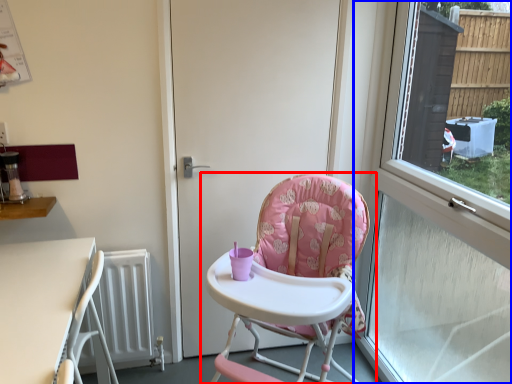
Question: Which object appears farthest to the camera in this image, chair (highlighted by a red box) or window (highlighted by a blue box)?

Choices:
 (A) chair
 (B) window

Answer: (A)